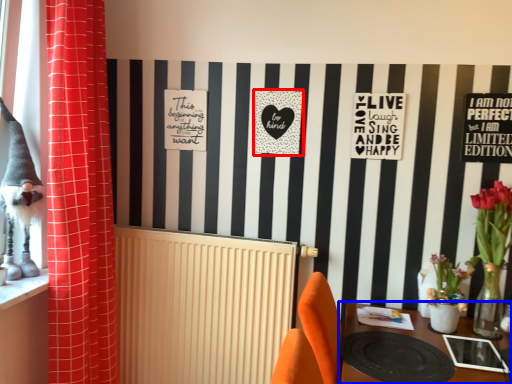
Question: Among these objects, which one is nearest to the camera, postcard (highlighted by a red box) or table (highlighted by a blue box)?

Choices:
 (A) postcard
 (B) table

Answer: (B)